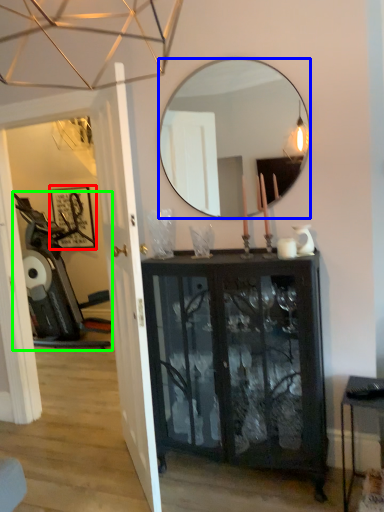
Question: Based on their relative distances, which object is nearer to picture frame (highlighted by a red box)? Choose from mirror (highlighted by a blue box) and swivel chair (highlighted by a green box).

Choices:
 (A) mirror
 (B) swivel chair

Answer: (B)